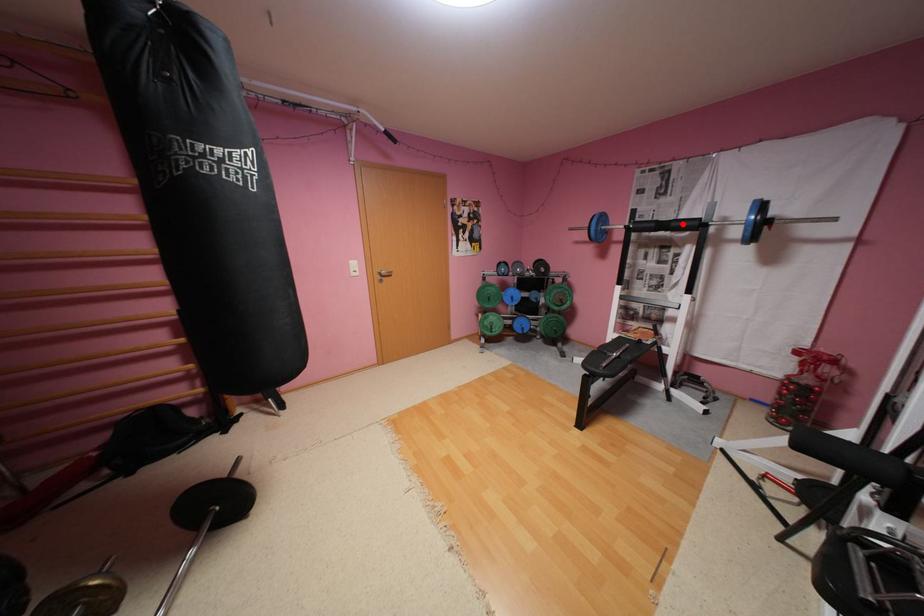
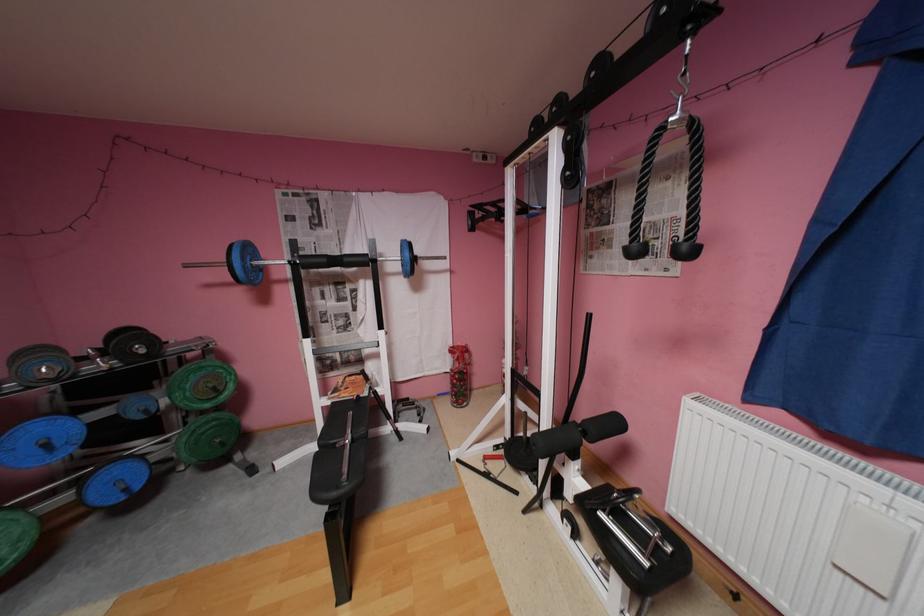
In the second image, find the point that corresponds to the highlighted location in the first image.

(355, 259)